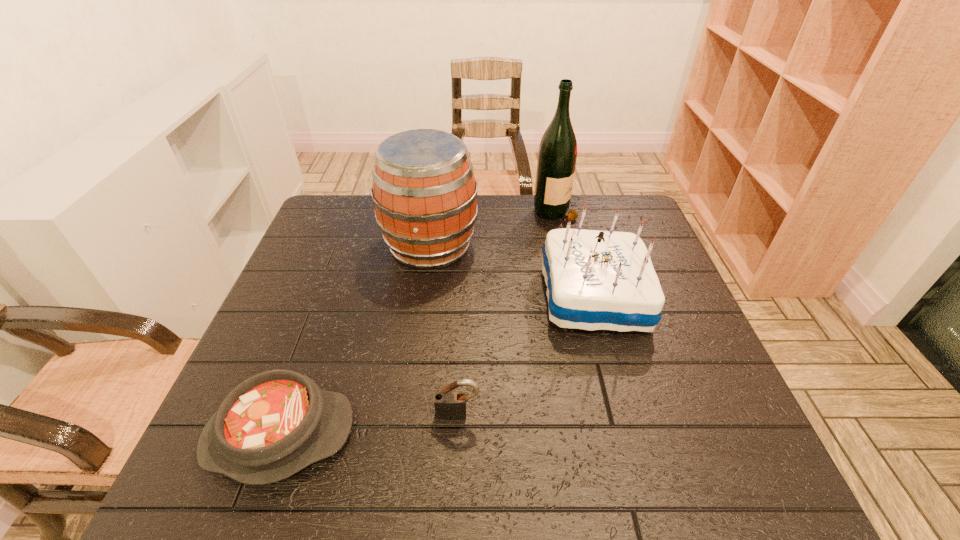
In the image, there is a desktop. Identify the location of vacant space at the far right corner. (588, 204).

Find the location of a particular element. This screenshot has width=960, height=540. free space between the second shortest object and the third shortest object is located at coordinates (526, 355).

The height and width of the screenshot is (540, 960). Find the location of `empty space between the birthday cake and the casserole`. empty space between the birthday cake and the casserole is located at coordinates (437, 366).

Where is `vacant point located between the cider and the wine bottle`? vacant point located between the cider and the wine bottle is located at coordinates (493, 229).

Image resolution: width=960 pixels, height=540 pixels. I want to click on vacant area that lies between the second tallest object and the shortest object, so click(355, 341).

I want to click on free space between the birthday cake and the shortest object, so click(437, 366).

Where is `vacant area that lies between the third tallest object and the shortest object`? The height and width of the screenshot is (540, 960). vacant area that lies between the third tallest object and the shortest object is located at coordinates (437, 366).

Where is `free space between the third shortest object and the fourth tallest object`? free space between the third shortest object and the fourth tallest object is located at coordinates (526, 355).

Identify the location of vacant region between the casserole and the third shortest object. The image size is (960, 540). (437, 366).

Where is `vacant point located between the padlock and the cider`? vacant point located between the padlock and the cider is located at coordinates (444, 330).